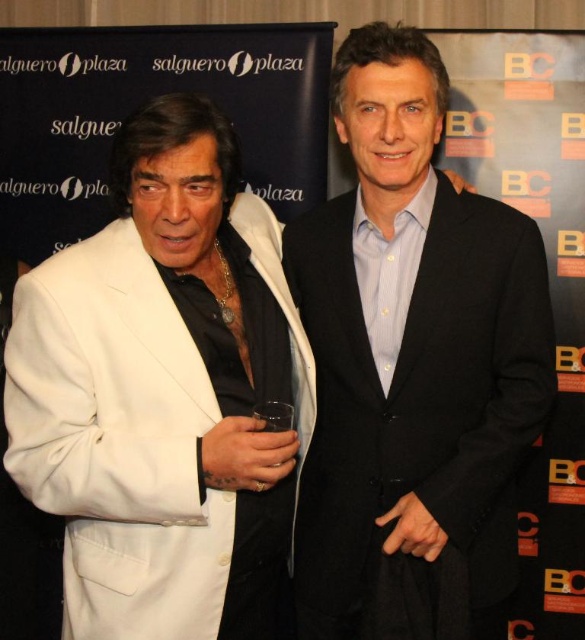
You are a photographer adjusting the camera focus. You notice two points in the image at coordinates point [417,54] and point [90,468]. Which point should you focus on first if you want to prioritize the closer object?

Point [417,54] is further to the viewer than point [90,468], so you should focus on point [417,54] first as it is closer to the viewer.

Looking at this image, you are a photographer setting up for a photoshoot. You need to position a light source so that it illuminates both the black matte suit at center and the white matte suit at left equally. Considering their heights, which suit should be placed closer to the light source to achieve even illumination?

The black matte suit at center is taller than the white matte suit at left, so to achieve even illumination, the white matte suit at left should be placed closer to the light source since it is shorter and requires less distance to receive adequate light.

You are a photographer trying to capture a wide shot of the two people in the image. The camera you are using has a limited field of view. Considering the black matte suit at center and the white matte suit at left, which one might be easier to fit into the frame due to their size difference?

The black matte suit at center has a lesser width compared to the white matte suit at left, so it might be easier to fit into the frame since it is narrower.